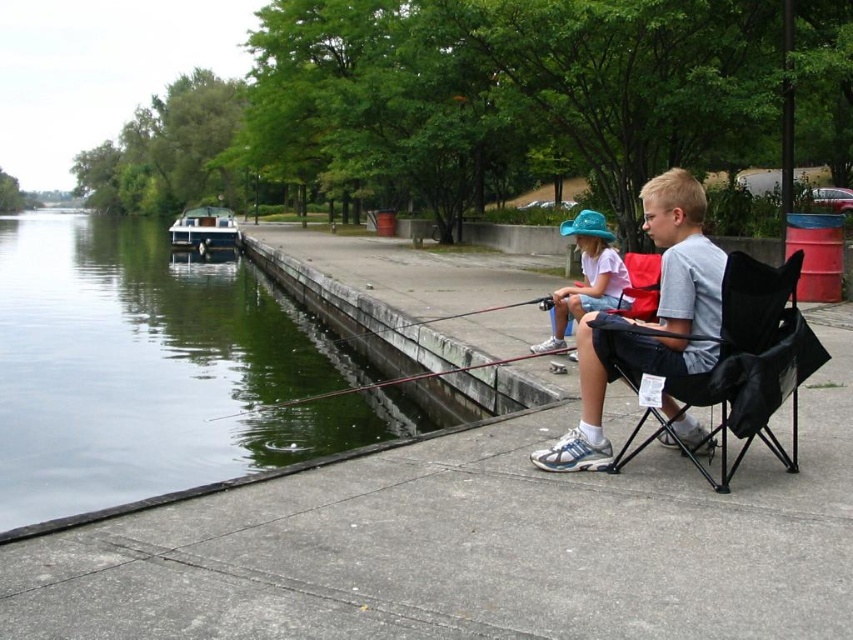
Question: Which object is the closest to the smooth black rod at center?

Choices:
 (A) green concrete river at lower left
 (B) smooth plastic rod at center
 (C) black fabric chair at right
 (D) polished wood boat at left

Answer: (B)

Question: Which of the following is the closest to the observer?

Choices:
 (A) green concrete river at lower left
 (B) polished wood boat at left
 (C) gray fabric chair at center
 (D) black fabric chair at right

Answer: (D)

Question: Can you confirm if black fabric chair at right is thinner than smooth plastic rod at center?

Choices:
 (A) no
 (B) yes

Answer: (A)

Question: Does light blue fabric hat at upper center appear under polished wood boat at left?

Choices:
 (A) no
 (B) yes

Answer: (B)

Question: From the image, what is the correct spatial relationship of black fabric chair at right in relation to smooth black rod at center?

Choices:
 (A) right
 (B) left

Answer: (A)

Question: Which of the following is the closest to the observer?

Choices:
 (A) (795, 268)
 (B) (627, 275)

Answer: (A)